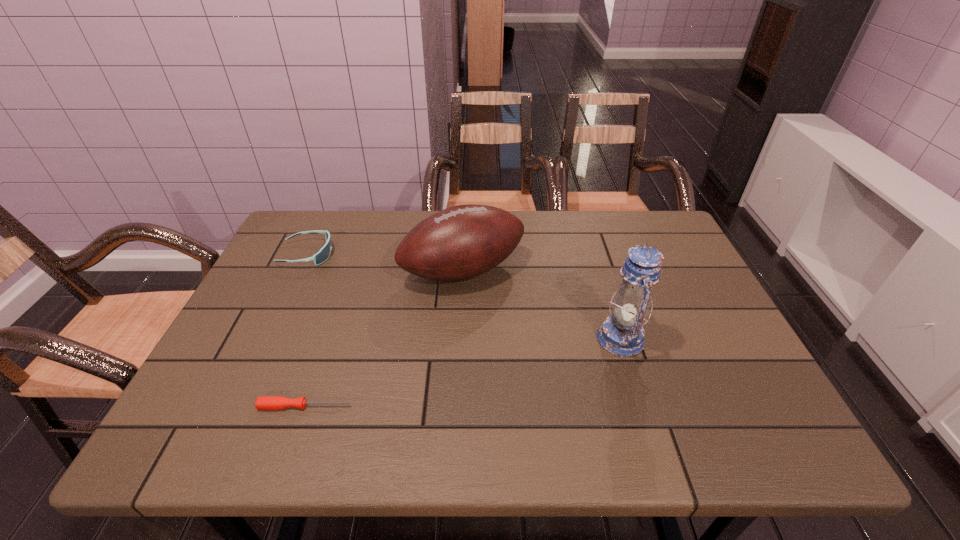
Where is `vacant space that satisfies the following two spatial constraints: 1. on the front-facing side of the second shortest object; 2. on the back side of the third shortest object`? The image size is (960, 540). vacant space that satisfies the following two spatial constraints: 1. on the front-facing side of the second shortest object; 2. on the back side of the third shortest object is located at coordinates (300, 271).